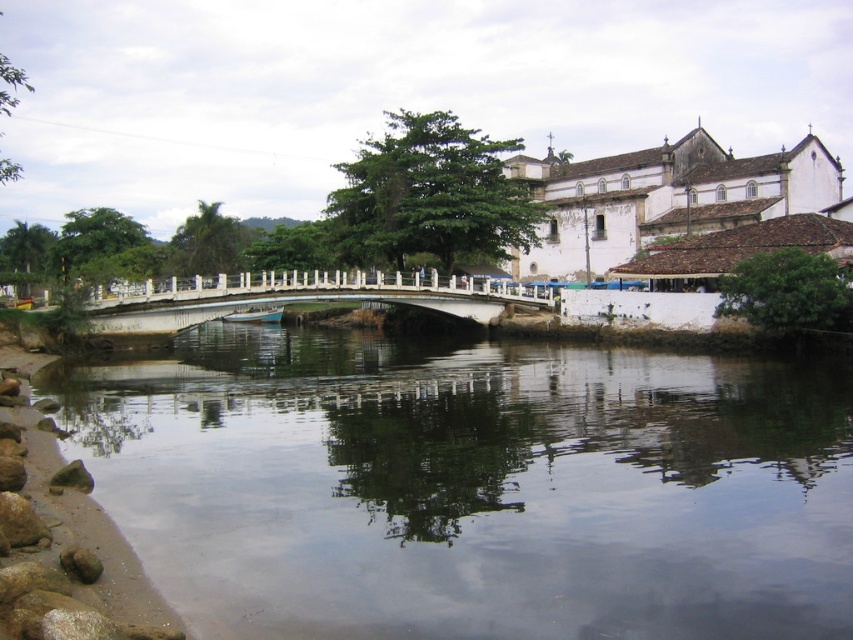
You are standing on the riverside and want to take a photo of the white concrete bridge at center and the light blue wooden boat at center. Which object should you focus on first to ensure it appears larger in your photo?

The white concrete bridge at center is closer to the viewer than the light blue wooden boat at center, so focusing on it first will make it appear larger in the photo.

You are standing on the bridge and want to take a photo of the clear water at center. Where should you position yourself to capture the reflection of the white building on the right in the water?

You should position yourself on the bridge facing the white building on the right to capture the reflection of the white building on the right in the clear water at center.